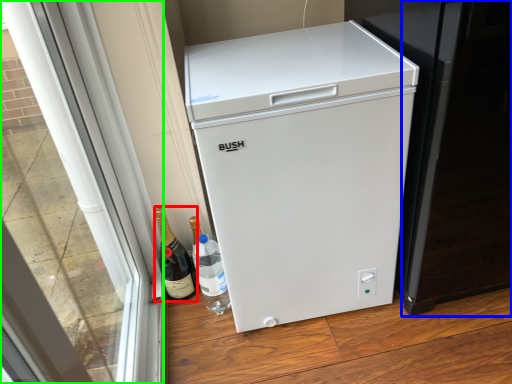
Question: Which object is the closest to the wine (highlighted by a red box)? Choose among these: screen door (highlighted by a blue box) or glass door (highlighted by a green box).

Choices:
 (A) screen door
 (B) glass door

Answer: (B)